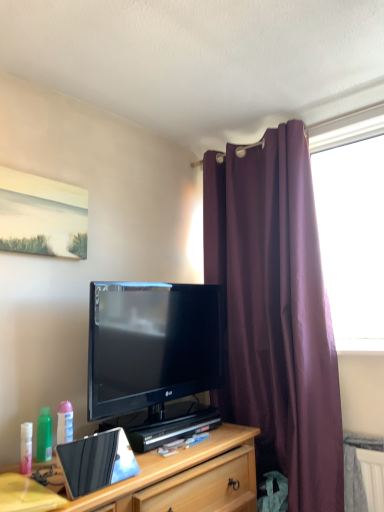
Question: Could wooden cabinet at lower center be considered to be inside black glossy tv at center?

Choices:
 (A) no
 (B) yes

Answer: (A)

Question: From a real-world perspective, is black glossy tv at center physically above wooden cabinet at lower center?

Choices:
 (A) no
 (B) yes

Answer: (B)

Question: Does black glossy tv at center appear on the left side of wooden cabinet at lower center?

Choices:
 (A) no
 (B) yes

Answer: (A)

Question: Considering the relative sizes of black glossy tv at center and wooden cabinet at lower center in the image provided, is black glossy tv at center smaller than wooden cabinet at lower center?

Choices:
 (A) no
 (B) yes

Answer: (B)

Question: From the image's perspective, is black glossy tv at center over wooden cabinet at lower center?

Choices:
 (A) yes
 (B) no

Answer: (A)

Question: Does black glossy tv at center appear on the right side of wooden cabinet at lower center?

Choices:
 (A) yes
 (B) no

Answer: (A)

Question: Is wooden cabinet at lower center facing towards metallic silver laptop at center?

Choices:
 (A) yes
 (B) no

Answer: (B)

Question: Is wooden cabinet at lower center bigger than metallic silver laptop at center?

Choices:
 (A) no
 (B) yes

Answer: (B)

Question: Is wooden cabinet at lower center far away from metallic silver laptop at center?

Choices:
 (A) no
 (B) yes

Answer: (A)

Question: From a real-world perspective, is wooden cabinet at lower center on top of metallic silver laptop at center?

Choices:
 (A) no
 (B) yes

Answer: (A)

Question: Is wooden cabinet at lower center smaller than metallic silver laptop at center?

Choices:
 (A) yes
 (B) no

Answer: (B)

Question: Considering the relative positions of wooden cabinet at lower center and metallic silver laptop at center in the image provided, is wooden cabinet at lower center to the left of metallic silver laptop at center from the viewer's perspective?

Choices:
 (A) no
 (B) yes

Answer: (A)

Question: Is yellow matte desk at lower left far from purple fabric curtain at right?

Choices:
 (A) no
 (B) yes

Answer: (B)